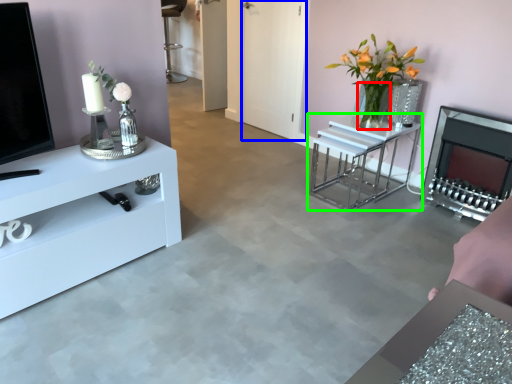
Question: Which object is positioned farthest from glass vase (highlighted by a red box)? Select from glass door (highlighted by a blue box) and table (highlighted by a green box).

Choices:
 (A) glass door
 (B) table

Answer: (A)